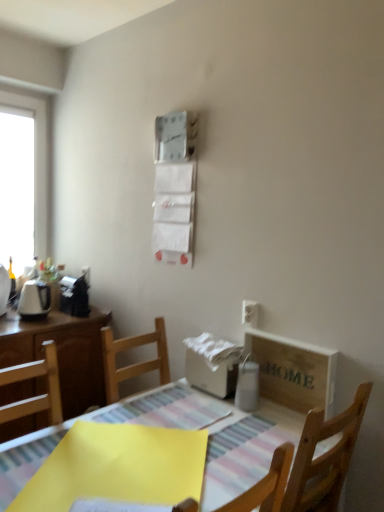
Where is `vacant area on top of yellow paper at lower left (from a real-world perspective)`? Image resolution: width=384 pixels, height=512 pixels. vacant area on top of yellow paper at lower left (from a real-world perspective) is located at coordinates (119, 462).